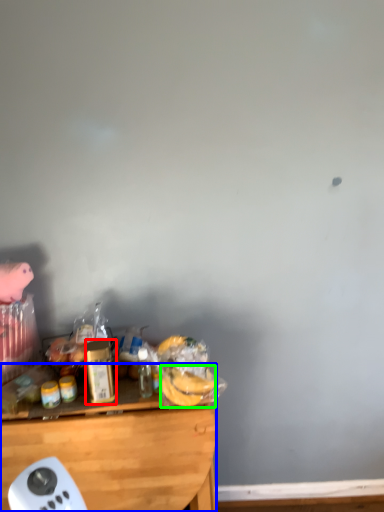
Question: Which object is positioned closest to bottle (highlighted by a red box)? Select from desk (highlighted by a blue box) and food (highlighted by a green box).

Choices:
 (A) desk
 (B) food

Answer: (A)